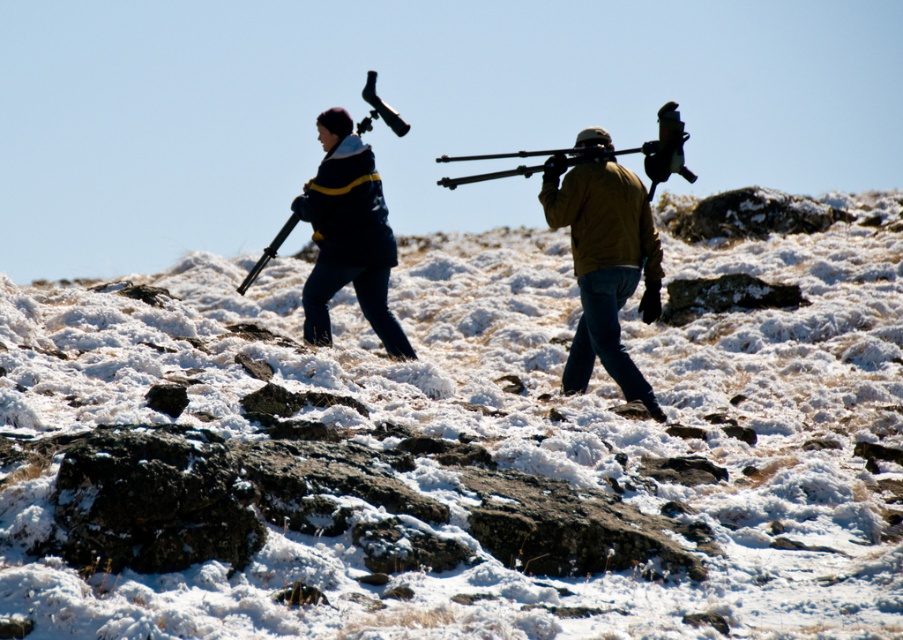
Question: Considering the relative positions of white fluffy snow at center and matte black rifle at center in the image provided, where is white fluffy snow at center located with respect to matte black rifle at center?

Choices:
 (A) right
 (B) left

Answer: (A)

Question: Estimate the real-world distances between objects in this image. Which object is farther from the white fluffy snow at center?

Choices:
 (A) brown leather jacket at center
 (B) matte black jacket at center
 (C) matte black rifle at center

Answer: (C)

Question: Considering the relative positions of matte black jacket at center and matte black rifle at center in the image provided, where is matte black jacket at center located with respect to matte black rifle at center?

Choices:
 (A) right
 (B) left

Answer: (A)

Question: Which object is closer to the camera taking this photo?

Choices:
 (A) brown leather jacket at center
 (B) matte black rifle at center
 (C) white fluffy snow at center
 (D) matte black jacket at center

Answer: (C)

Question: Which of the following is the farthest from the observer?

Choices:
 (A) (656, 236)
 (B) (375, 300)
 (C) (284, 228)

Answer: (C)

Question: Does white fluffy snow at center appear on the left side of brown leather jacket at center?

Choices:
 (A) no
 (B) yes

Answer: (B)